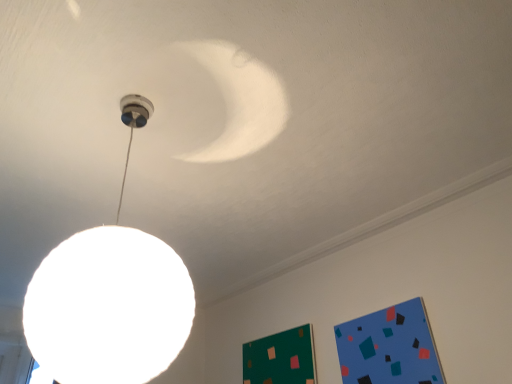
Question: From a real-world perspective, is green matte bulletin board at lower right, positioned as the 1th bulletin board in left-to-right order, physically located above or below white matte globe lamp at upper center?

Choices:
 (A) above
 (B) below

Answer: (B)

Question: Is green matte bulletin board at lower right, positioned as the 1th bulletin board in left-to-right order, situated inside white matte globe lamp at upper center or outside?

Choices:
 (A) outside
 (B) inside

Answer: (A)

Question: Estimate the real-world distances between objects in this image. Which object is closer to the blue matte bulletin board at lower right, which is the 2th bulletin board from left to right?

Choices:
 (A) green matte bulletin board at lower right, positioned as the 1th bulletin board in left-to-right order
 (B) white matte ceiling at upper center
 (C) white matte globe lamp at upper center

Answer: (B)

Question: Based on their relative distances, which object is nearer to the white matte ceiling at upper center?

Choices:
 (A) green matte bulletin board at lower right, positioned as the 1th bulletin board in left-to-right order
 (B) white matte globe lamp at upper center
 (C) blue matte bulletin board at lower right, the 2th bulletin board in the back-to-front sequence

Answer: (C)